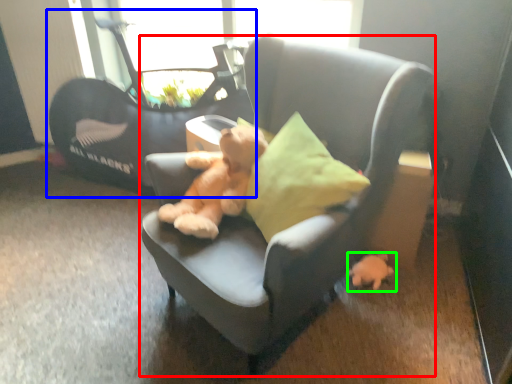
Question: Which object is positioned farthest from chair (highlighted by a red box)? Select from baby carriage (highlighted by a blue box) and toy (highlighted by a green box).

Choices:
 (A) baby carriage
 (B) toy

Answer: (A)